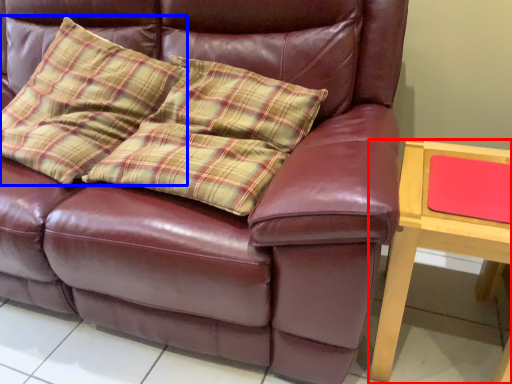
Question: Which point is further to the camera, table (highlighted by a red box) or throw pillow (highlighted by a blue box)?

Choices:
 (A) table
 (B) throw pillow

Answer: (B)